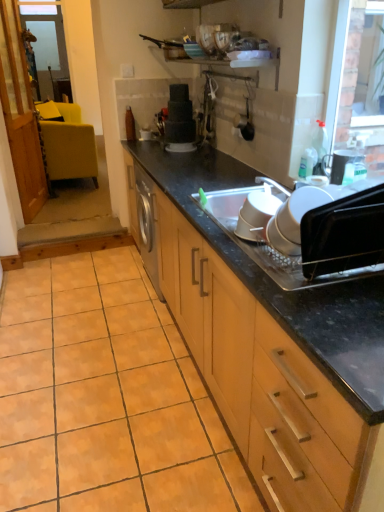
Identify the location of black plastic oven at right, positioned as the fourth appliance in back-to-front order. (344, 234).

What is the approximate width of white plastic bowls at center, marked as the second appliance in a front-to-back arrangement?

It is 7.73 inches.

Describe the element at coordinates (68, 145) in the screenshot. I see `matte yellow chair at left` at that location.

This screenshot has height=512, width=384. Find the location of `matte black cake at center, positioned as the 1th appliance in top-to-bottom order`. matte black cake at center, positioned as the 1th appliance in top-to-bottom order is located at coordinates (180, 118).

The width and height of the screenshot is (384, 512). I want to click on black plastic oven at right, which ranks as the 1th appliance in bottom-to-top order, so click(x=344, y=234).

Identify the location of ceramic tile in front of the matte black toaster at upper right, the second appliance in the top-to-bottom sequence. This screenshot has width=384, height=512. (105, 397).

Consider the image. Is matte black toaster at upper right, the 2th appliance positioned from the back, at the right side of orange matte tile at lower left?

Yes.

Relative to orange matte tile at lower left, is matte black toaster at upper right, the second appliance in the top-to-bottom sequence, in front or behind?

matte black toaster at upper right, the second appliance in the top-to-bottom sequence, is positioned farther from the viewer than orange matte tile at lower left.

Does point (336, 172) lie behind point (22, 396)?

That is False.

In the image, is matte black cake at center, positioned as the 1th appliance in top-to-bottom order, positioned in front of or behind black plastic oven at right, acting as the 2th appliance starting from the right?

Clearly, matte black cake at center, positioned as the 1th appliance in top-to-bottom order, is behind black plastic oven at right, acting as the 2th appliance starting from the right.

I want to click on appliance above the black plastic oven at right, placed as the third appliance when sorted from left to right (from a real-world perspective), so click(180, 118).

Could you measure the distance between matte black cake at center, which is the fourth appliance from front to back, and black plastic oven at right, acting as the 2th appliance starting from the right?

matte black cake at center, which is the fourth appliance from front to back, and black plastic oven at right, acting as the 2th appliance starting from the right, are 1.90 meters apart from each other.

Is matte black cake at center, arranged as the fourth appliance when viewed from the right, beside black plastic oven at right, positioned as the fourth appliance in back-to-front order?

No, matte black cake at center, arranged as the fourth appliance when viewed from the right, is not beside black plastic oven at right, positioned as the fourth appliance in back-to-front order.

Which is correct: matte black cake at center, the fourth appliance when ordered from bottom to top, is inside white plastic bowls at center, positioned as the 2th appliance in bottom-to-top order, or outside of it?

matte black cake at center, the fourth appliance when ordered from bottom to top, is located beyond the bounds of white plastic bowls at center, positioned as the 2th appliance in bottom-to-top order.

Is matte black cake at center, the fourth appliance when ordered from bottom to top, not close to white plastic bowls at center, positioned as the 2th appliance in bottom-to-top order?

Yes, matte black cake at center, the fourth appliance when ordered from bottom to top, is far from white plastic bowls at center, positioned as the 2th appliance in bottom-to-top order.

Does matte black cake at center, which is the fourth appliance from front to back, appear on the left side of white plastic bowls at center, marked as the second appliance in a front-to-back arrangement?

Yes, matte black cake at center, which is the fourth appliance from front to back, is to the left of white plastic bowls at center, marked as the second appliance in a front-to-back arrangement.

From a real-world perspective, which is physically above, matte black cake at center, acting as the 1th appliance starting from the left, or white plastic bowls at center, the 3th appliance positioned from the back?

matte black cake at center, acting as the 1th appliance starting from the left, is physically above.

Considering the sizes of objects orange matte tile at lower left and white plastic bowls at center, marked as the second appliance in a front-to-back arrangement, in the image provided, who is bigger, orange matte tile at lower left or white plastic bowls at center, marked as the second appliance in a front-to-back arrangement,?

orange matte tile at lower left is bigger.

From the image's perspective, is orange matte tile at lower left under white plastic bowls at center, positioned as the 2th appliance in bottom-to-top order?

Yes, from the image's perspective, orange matte tile at lower left is beneath white plastic bowls at center, positioned as the 2th appliance in bottom-to-top order.

The image size is (384, 512). In order to click on ceramic tile that is below the white plastic bowls at center, the 3th appliance viewed from the top (from the image's perspective) in this screenshot , I will do `click(105, 397)`.

Between point (39, 387) and point (55, 54), which one is positioned behind?

The point (55, 54) is farther from the camera.

The width and height of the screenshot is (384, 512). Find the location of `window screen located above the orange matte tile at lower left (from a real-world perspective)`. window screen located above the orange matte tile at lower left (from a real-world perspective) is located at coordinates (49, 53).

Is orange matte tile at lower left placed right next to transparent glass window screen at upper left?

No, orange matte tile at lower left is not beside transparent glass window screen at upper left.

From a real-world perspective, which object rests below the other?

orange matte tile at lower left is physically lower.

Which is behind, wooden cabinet at center or matte black cake at center, acting as the 1th appliance starting from the left?

Positioned behind is matte black cake at center, acting as the 1th appliance starting from the left.

Based on the photo, is matte black cake at center, arranged as the fourth appliance when viewed from the right, a part of wooden cabinet at center?

No, matte black cake at center, arranged as the fourth appliance when viewed from the right, is not inside wooden cabinet at center.

From the image's perspective, between wooden cabinet at center and matte black cake at center, the fourth appliance when ordered from bottom to top, who is located below?

From the image's view, wooden cabinet at center is below.

Consider the image. Is matte black toaster at upper right, positioned as the 1th appliance in right-to-left order, facing away from white plastic bowls at center, marked as the second appliance in a left-to-right arrangement?

That's not correct — matte black toaster at upper right, positioned as the 1th appliance in right-to-left order, is not looking away from white plastic bowls at center, marked as the second appliance in a left-to-right arrangement.

Are matte black toaster at upper right, the 3th appliance in the front-to-back sequence, and white plastic bowls at center, which ranks as the third appliance in right-to-left order, making contact?

matte black toaster at upper right, the 3th appliance in the front-to-back sequence, is not next to white plastic bowls at center, which ranks as the third appliance in right-to-left order, and they're not touching.

At what (x,y) coordinates should I click in order to perform the action: click on the 2nd appliance counting from the left side of the matte black toaster at upper right, positioned as the 1th appliance in right-to-left order. Please return your answer as a coordinate pair (x, y). Looking at the image, I should click on (256, 215).

Between point (330, 173) and point (276, 202), which one is positioned in front?

Positioned in front is point (276, 202).

Where is `the 4th appliance counting from the right side of the orange matte tile at lower left`? The image size is (384, 512). the 4th appliance counting from the right side of the orange matte tile at lower left is located at coordinates (339, 164).

The image size is (384, 512). Identify the location of appliance that is the 3rd one when counting upward from the black plastic oven at right, acting as the 2th appliance starting from the right (from the image's perspective). (180, 118).

Based on their spatial positions, is black plastic oven at right, positioned as the fourth appliance in back-to-front order, or matte black cake at center, which ranks as the 1th appliance in back-to-front order, further from white plastic bowls at center, positioned as the 2th appliance in bottom-to-top order?

The object further to white plastic bowls at center, positioned as the 2th appliance in bottom-to-top order, is matte black cake at center, which ranks as the 1th appliance in back-to-front order.

From the picture: Looking at the image, which one is located further to orange matte tile at lower left, matte black cake at center, which ranks as the 1th appliance in back-to-front order, or white plastic bowls at center, the 3th appliance viewed from the top?

Based on the image, matte black cake at center, which ranks as the 1th appliance in back-to-front order, appears to be further to orange matte tile at lower left.

Looking at the image, which one is located closer to transparent glass window screen at upper left, white plastic bowls at center, the 3th appliance viewed from the top, or wooden cabinet at center?

wooden cabinet at center is positioned closer to the anchor transparent glass window screen at upper left.

When comparing their distances from white plastic bowls at center, which ranks as the third appliance in right-to-left order, does matte black cake at center, which is the fourth appliance from front to back, or matte black toaster at upper right, which is the 3th appliance from bottom to top, seem further?

matte black cake at center, which is the fourth appliance from front to back.

Estimate the real-world distances between objects in this image. Which object is further from matte black toaster at upper right, positioned as the 1th appliance in right-to-left order, matte black cake at center, acting as the 1th appliance starting from the left, or white plastic bowls at center, the 3th appliance viewed from the top?

Based on the image, matte black cake at center, acting as the 1th appliance starting from the left, appears to be further to matte black toaster at upper right, positioned as the 1th appliance in right-to-left order.

Based on their spatial positions, is orange matte tile at lower left or transparent glass window screen at upper left further from black plastic oven at right, positioned as the fourth appliance in back-to-front order?

transparent glass window screen at upper left lies further to black plastic oven at right, positioned as the fourth appliance in back-to-front order, than the other object.

Consider the image. Which object lies nearer to the anchor point wooden cabinet at center, white plastic bowls at center, marked as the second appliance in a left-to-right arrangement, or black plastic oven at right, which ranks as the 1th appliance in bottom-to-top order?

Among the two, black plastic oven at right, which ranks as the 1th appliance in bottom-to-top order, is located nearer to wooden cabinet at center.

From the image, which object appears to be nearer to matte black toaster at upper right, which is the fourth appliance from left to right, white plastic bowls at center, the 3th appliance viewed from the top, or matte black cake at center, which ranks as the 1th appliance in back-to-front order?

white plastic bowls at center, the 3th appliance viewed from the top, is closer to matte black toaster at upper right, which is the fourth appliance from left to right.

Find the location of a particular element. appliance between matte black toaster at upper right, which is the fourth appliance from left to right, and matte yellow chair at left in the front-back direction is located at coordinates (180, 118).

Find the location of a particular element. The width and height of the screenshot is (384, 512). ceramic tile positioned between black plastic oven at right, which ranks as the 1th appliance in bottom-to-top order, and transparent glass window screen at upper left from near to far is located at coordinates (105, 397).

This screenshot has width=384, height=512. In order to click on chair located between white plastic bowls at center, the 3th appliance viewed from the top, and transparent glass window screen at upper left in the depth direction in this screenshot , I will do `click(68, 145)`.

Identify the location of ceramic tile positioned between wooden cabinet at center and transparent glass window screen at upper left from near to far. (105, 397).